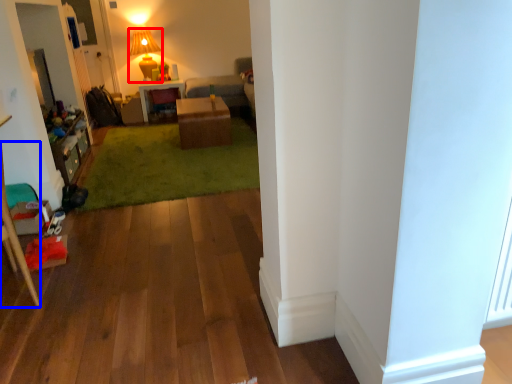
Question: Which point is further to the camera, lamp (highlighted by a red box) or furniture (highlighted by a blue box)?

Choices:
 (A) lamp
 (B) furniture

Answer: (A)